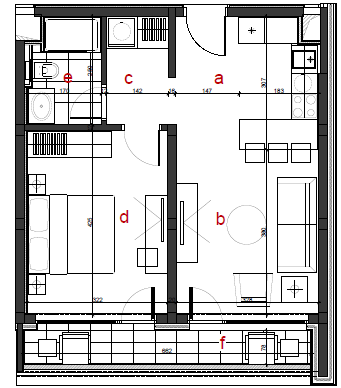
Locate an element on the screen. bed is located at coordinates (74, 229).